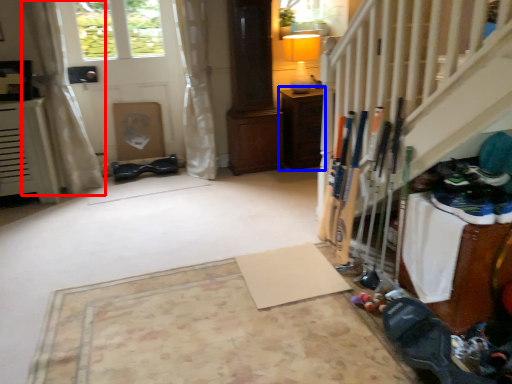
Question: Which point is further to the camera, curtain (highlighted by a red box) or furniture (highlighted by a blue box)?

Choices:
 (A) curtain
 (B) furniture

Answer: (B)